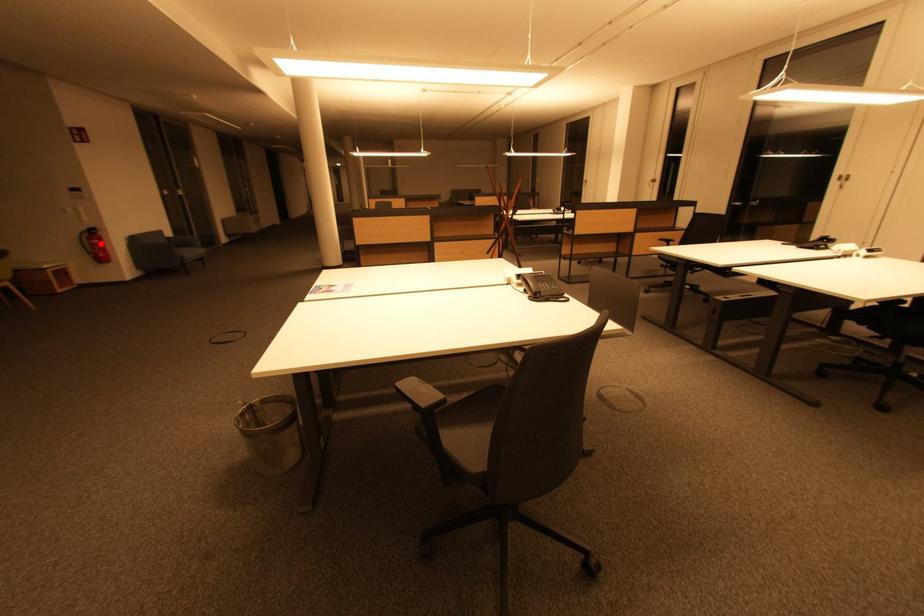
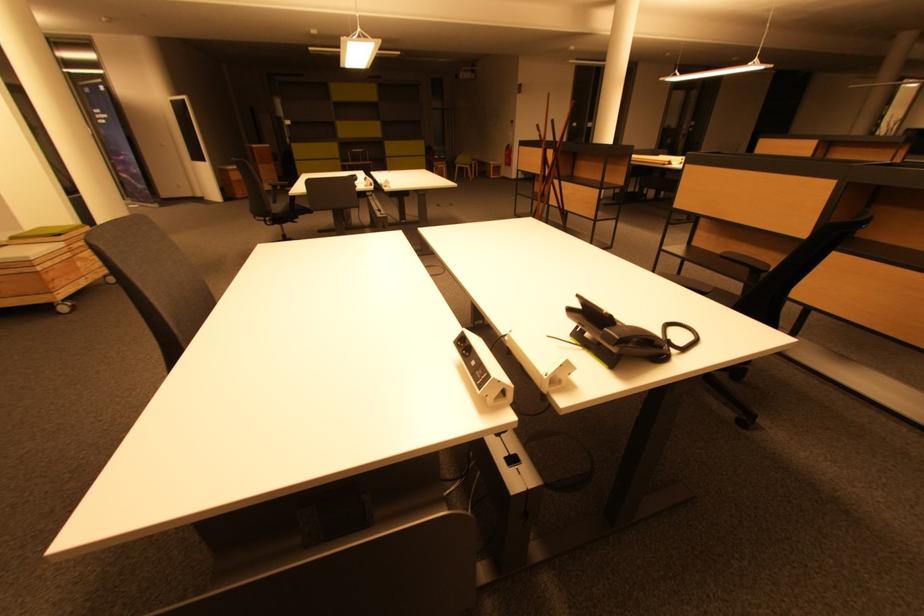
Find the pixel in the second image that matches the highlighted location in the first image.

(512, 155)